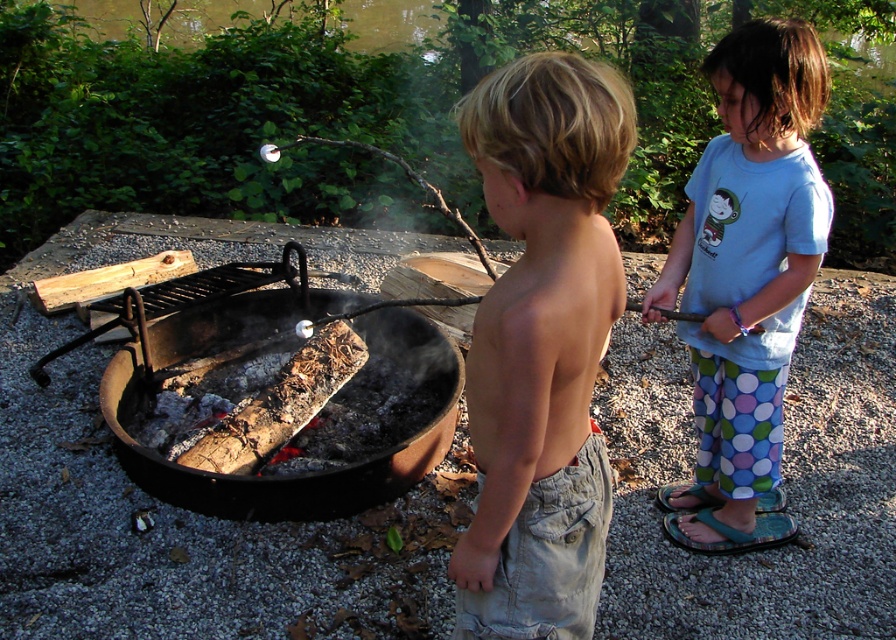
Question: From the image, what is the correct spatial relationship of light brown hair at center in relation to charred wood fire pit at center?

Choices:
 (A) right
 (B) left

Answer: (A)

Question: Among these objects, which one is farthest from the camera?

Choices:
 (A) light brown hair at center
 (B) charred wood fire pit at center

Answer: (B)

Question: Is light brown hair at center positioned in front of blue cotton shirt at upper right?

Choices:
 (A) yes
 (B) no

Answer: (A)

Question: Can you confirm if light brown hair at center is positioned above charred wood fire pit at center?

Choices:
 (A) no
 (B) yes

Answer: (B)

Question: Which of the following is the closest to the observer?

Choices:
 (A) (317, 499)
 (B) (756, 102)
 (C) (571, 346)

Answer: (C)

Question: Which point is farther to the camera?

Choices:
 (A) tap(355, 404)
 (B) tap(703, 259)
 (C) tap(591, 74)

Answer: (A)